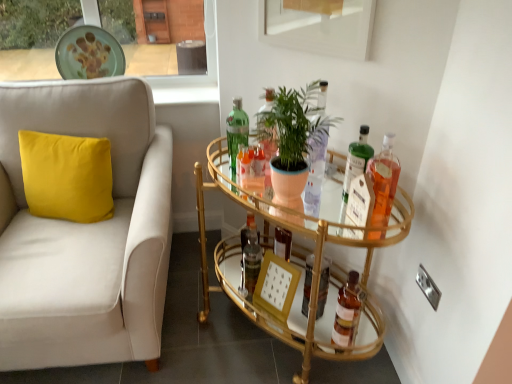
Question: Is green matte plant at center further to camera compared to translucent glass bottle at upper right, marked as the first bottle in a right-to-left arrangement?

Choices:
 (A) no
 (B) yes

Answer: (A)

Question: Is green matte plant at center oriented away from translucent glass bottle at upper right, marked as the first bottle in a right-to-left arrangement?

Choices:
 (A) yes
 (B) no

Answer: (B)

Question: Is green matte plant at center not within translucent glass bottle at upper right, the 5th bottle from the left?

Choices:
 (A) no
 (B) yes

Answer: (B)

Question: Can translucent glass bottle at upper right, marked as the first bottle in a right-to-left arrangement, be found inside green matte plant at center?

Choices:
 (A) yes
 (B) no

Answer: (B)

Question: Does green matte plant at center appear on the right side of translucent glass bottle at upper right, the 5th bottle from the left?

Choices:
 (A) yes
 (B) no

Answer: (B)

Question: Could you tell me if green matte plant at center is facing translucent glass bottle at upper right, marked as the first bottle in a right-to-left arrangement?

Choices:
 (A) yes
 (B) no

Answer: (B)

Question: Are translucent glass bottle at upper right, the third bottle when ordered from left to right, and green glass bottle at center, the 1th bottle in the left-to-right sequence, beside each other?

Choices:
 (A) no
 (B) yes

Answer: (A)

Question: From the image's perspective, is translucent glass bottle at upper right, the third bottle when ordered from left to right, on top of green glass bottle at center, positioned as the fifth bottle in right-to-left order?

Choices:
 (A) yes
 (B) no

Answer: (B)

Question: Is translucent glass bottle at upper right, which is counted as the 3th bottle, starting from the right, to the right of green glass bottle at center, the 1th bottle in the left-to-right sequence, from the viewer's perspective?

Choices:
 (A) yes
 (B) no

Answer: (A)

Question: Considering the relative sizes of translucent glass bottle at upper right, which is counted as the 3th bottle, starting from the right, and green glass bottle at center, positioned as the fifth bottle in right-to-left order, in the image provided, is translucent glass bottle at upper right, which is counted as the 3th bottle, starting from the right, bigger than green glass bottle at center, positioned as the fifth bottle in right-to-left order,?

Choices:
 (A) no
 (B) yes

Answer: (A)

Question: Is translucent glass bottle at upper right, which is counted as the 3th bottle, starting from the right, positioned far away from green glass bottle at center, the 1th bottle in the left-to-right sequence?

Choices:
 (A) yes
 (B) no

Answer: (B)

Question: Would you say translucent glass bottle at upper right, which is counted as the 3th bottle, starting from the right, is outside green glass bottle at center, the 1th bottle in the left-to-right sequence?

Choices:
 (A) yes
 (B) no

Answer: (A)

Question: From the image's perspective, does wooden picture frame at center appear lower than translucent glass bottle at upper right, which is counted as the 3th bottle, starting from the right?

Choices:
 (A) no
 (B) yes

Answer: (B)